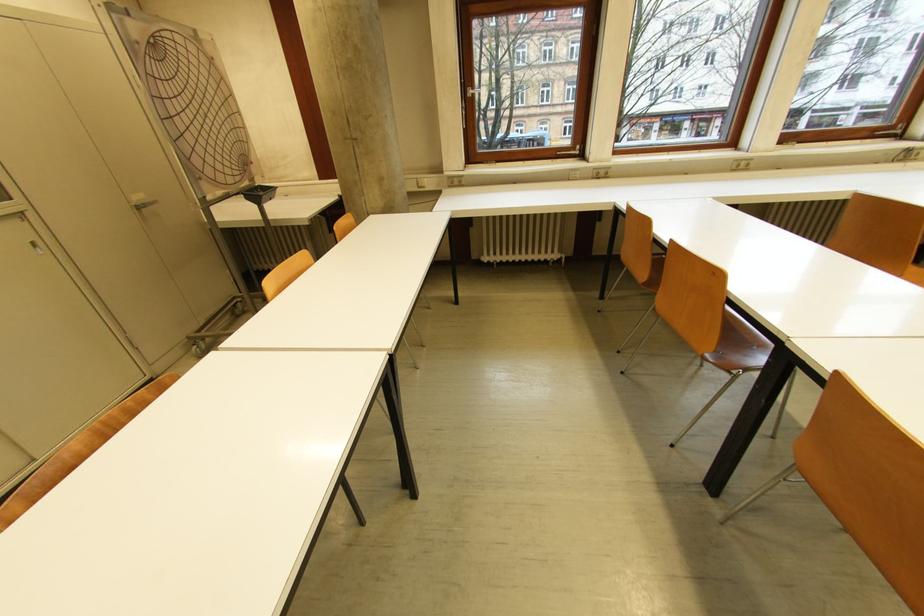
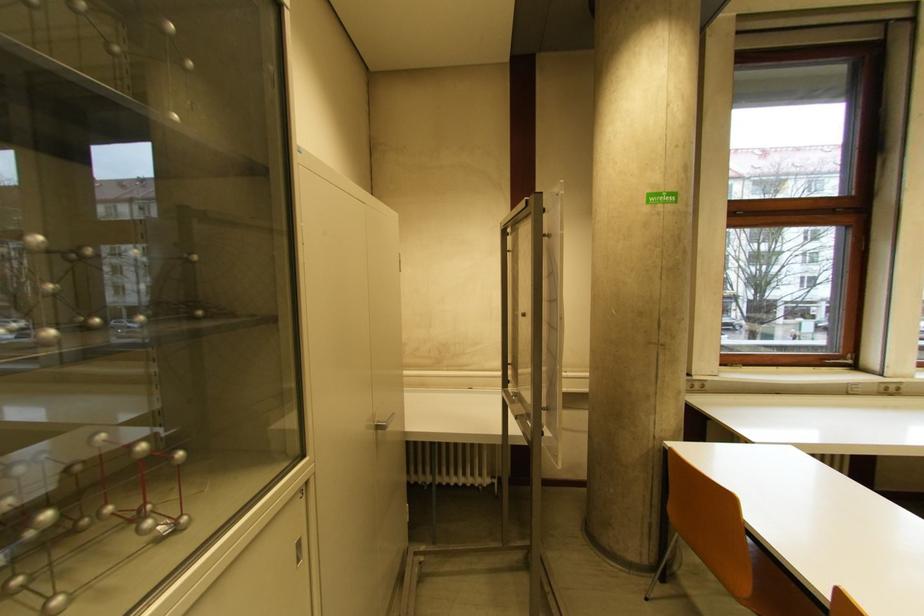
From the picture: The images are taken continuously from a first-person perspective. In which direction are you moving?

The cameraman moved toward left, forward.